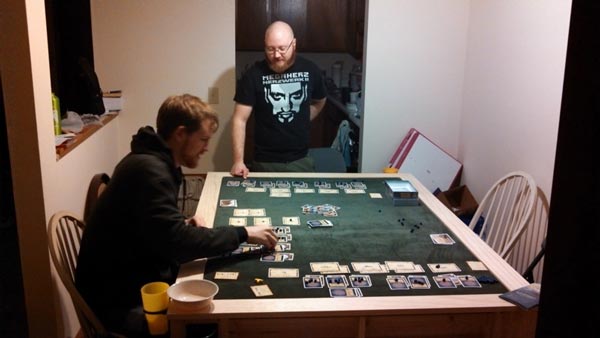
Where is `table`? The height and width of the screenshot is (338, 600). table is located at coordinates (445, 209).